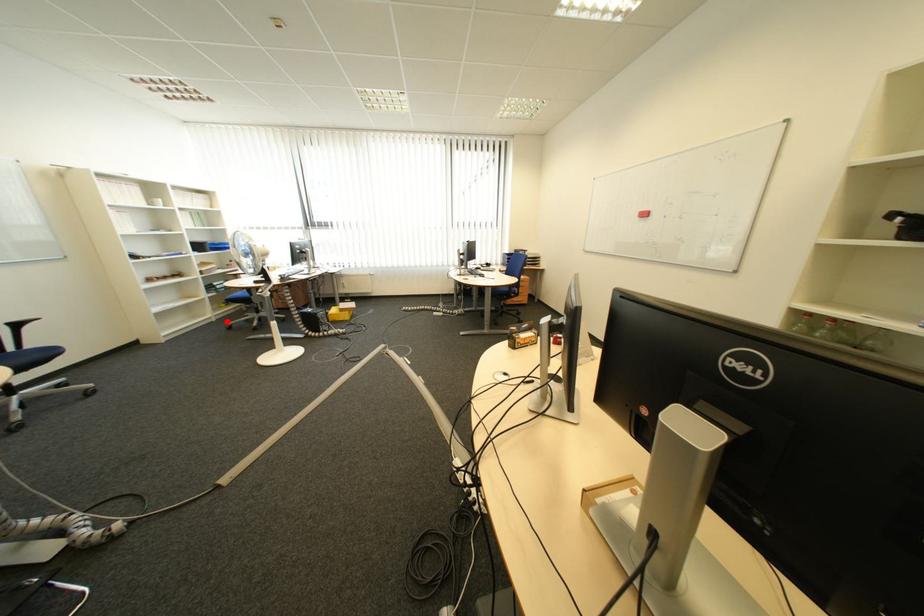
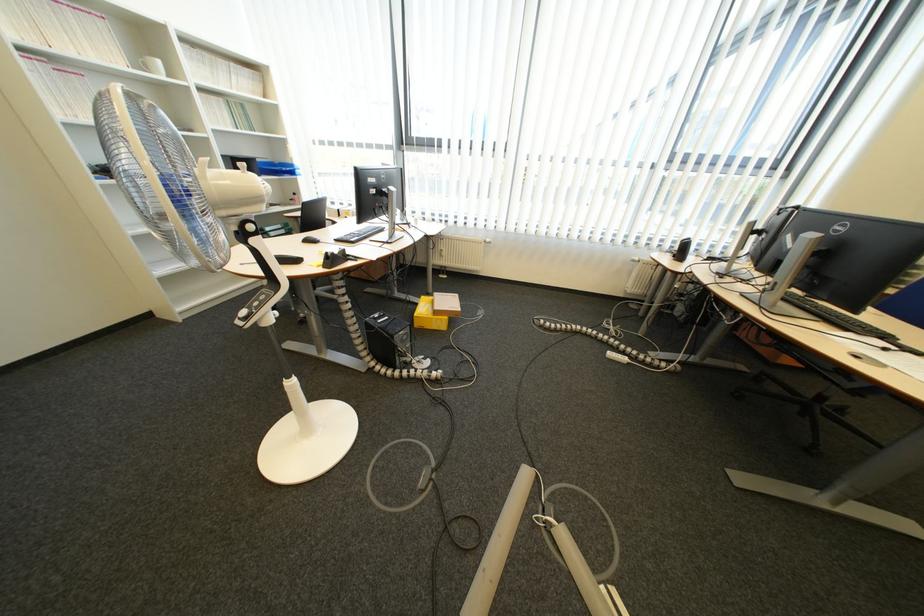
Question: I am providing you with two images of the same scene from different viewpoints. A red point is marked on the first image. Is the red point's position out of view in image 2?

Choices:
 (A) Yes
 (B) No

Answer: (B)